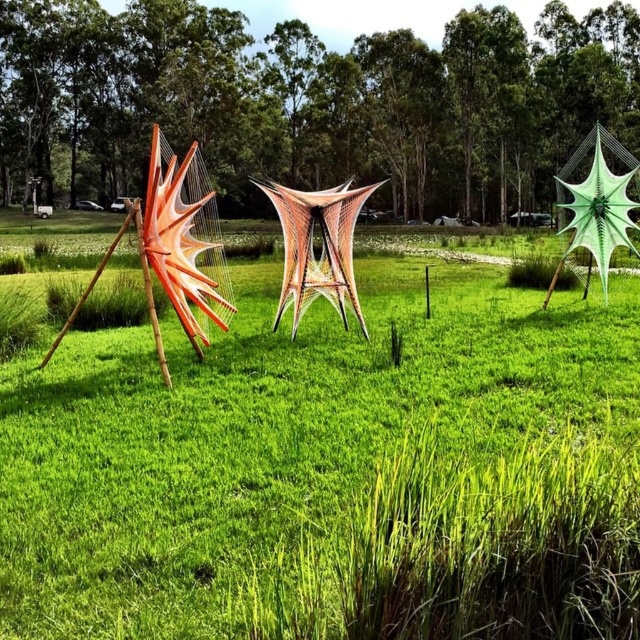
Does green matte sculpture at center have a larger size compared to translucent orange net at center?

Yes, green matte sculpture at center is bigger than translucent orange net at center.

Does green matte sculpture at center lie in front of translucent orange net at center?

No, green matte sculpture at center is further to the viewer.

Between point (54, 104) and point (307, 225), which one is positioned in front?

Point (307, 225) is in front.

This screenshot has height=640, width=640. In order to click on green matte sculpture at center in this screenshot , I will do `click(310, 104)`.

Who is taller, orange woven hammock at left or green matte sculpture at center?

green matte sculpture at center

Between orange woven hammock at left and green matte sculpture at center, which one appears on the right side from the viewer's perspective?

orange woven hammock at left is more to the right.

Image resolution: width=640 pixels, height=640 pixels. What are the coordinates of `orange woven hammock at left` in the screenshot? It's located at (264, 433).

Does point (212, 200) lie behind point (632, 225)?

Yes, it is behind point (632, 225).

Between orange matte kite at left and green matte kite at right, which one has more height?

With more height is green matte kite at right.

Is point (220, 314) in front of point (573, 152)?

Yes.

This screenshot has width=640, height=640. Identify the location of orange matte kite at left. (186, 237).